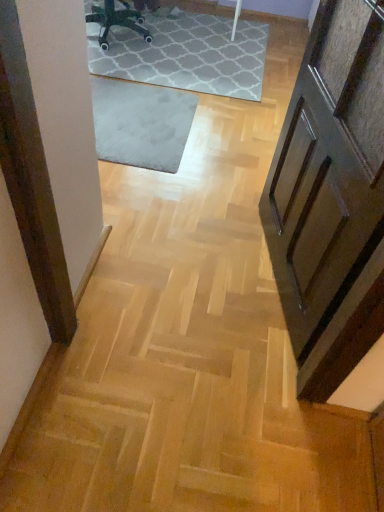
Question: Is point (286, 302) positioned closer to the camera than point (135, 114)?

Choices:
 (A) farther
 (B) closer

Answer: (B)

Question: From a real-world perspective, is wooden panelled door at right positioned above or below gray soft rug at center?

Choices:
 (A) below
 (B) above

Answer: (B)

Question: Estimate the real-world distances between objects in this image. Which object is farther from the gray soft rug at center?

Choices:
 (A) black plastic chair at upper center
 (B) wooden panelled door at right

Answer: (B)

Question: Estimate the real-world distances between objects in this image. Which object is closer to the black plastic chair at upper center?

Choices:
 (A) gray soft rug at center
 (B) wooden panelled door at right

Answer: (A)